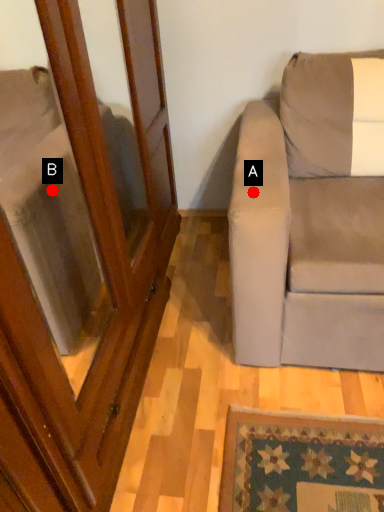
Question: Two points are circled on the image, labeled by A and B beside each circle. Which of the following is the farthest from the observer?

Choices:
 (A) A is further
 (B) B is further

Answer: (B)